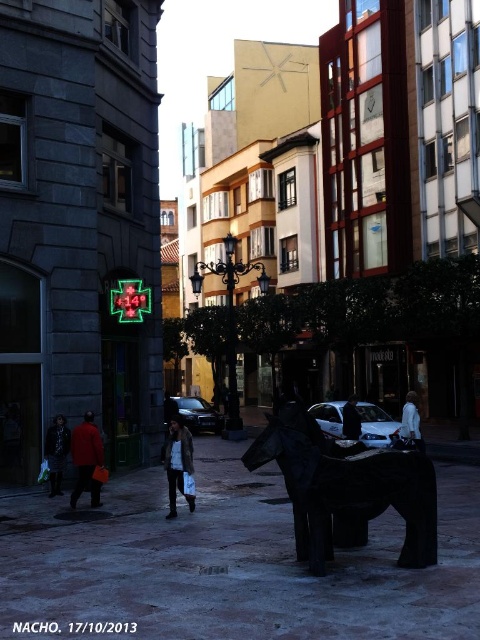
You are standing at the point where the elephant statue is located. You need to hand a dark brown leather jacket to someone at point (x=57, y=452). In which direction should you walk to reach that point?

You should walk towards the lower left direction to reach point (x=57, y=452) where the dark brown leather jacket is located.

You are standing at the center of the street and see the dark brown leather jacket at lower left. Where is the dark brown leather jacket located relative to your position?

The dark brown leather jacket at lower left is located at point (57, 452), which is to the lower left of your current position.

You are standing on the street and see the matte red coat at lower left and the white matte coat at lower right. Which person is nearer to you?

The matte red coat at lower left is closer to the viewer than the white matte coat at lower right, so the person wearing the matte red coat at lower left is nearer.